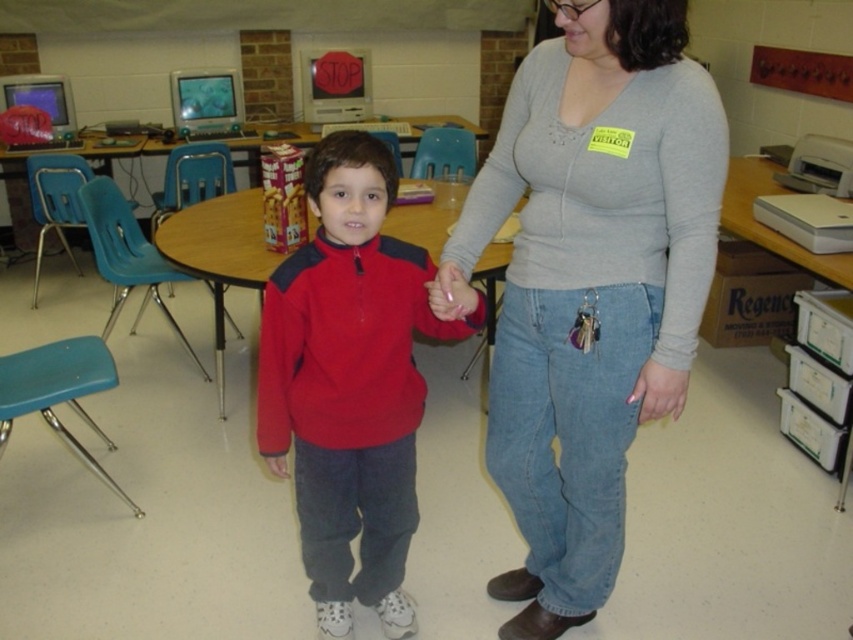
Which is in front, point (544, 241) or point (444, 321)?

Point (544, 241) is more forward.

Is gray sweater at center wider than matte red sweater at center?

Indeed, gray sweater at center has a greater width compared to matte red sweater at center.

Does point (543, 282) come farther from viewer compared to point (370, 524)?

That is False.

Locate an element on the screen. gray sweater at center is located at coordinates (590, 282).